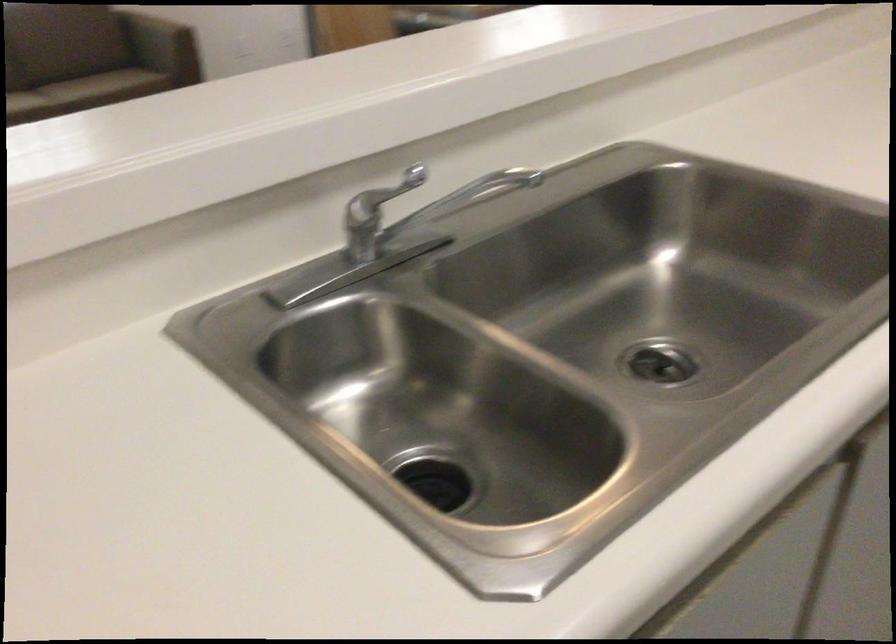
You are a GUI agent. You are given a task and a screenshot of the screen. Output one action in this format:
    pyautogui.click(x=<x>, y=<y>)
    Task: Click on the faucet handle
    This screenshot has width=896, height=644.
    Given the screenshot: What is the action you would take?
    pyautogui.click(x=374, y=214)